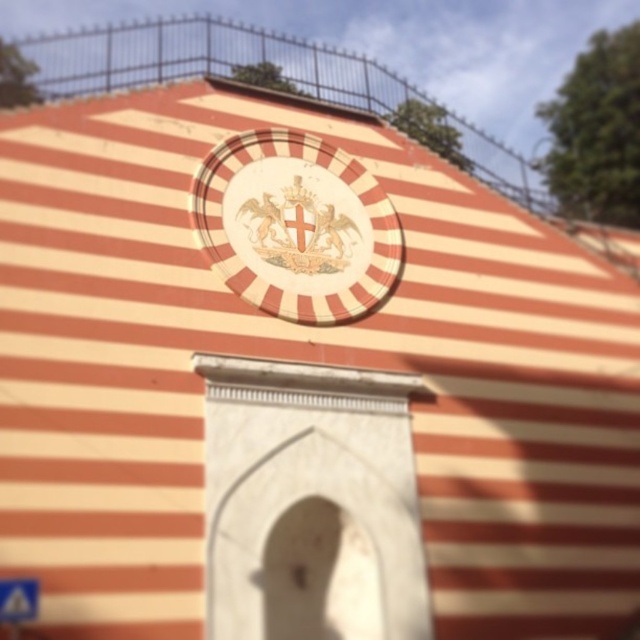
Question: Is white glossy emblem at center positioned behind blue plastic street sign at lower left?

Choices:
 (A) yes
 (B) no

Answer: (A)

Question: Which point is closer to the camera?

Choices:
 (A) (29, 608)
 (B) (332, 259)

Answer: (A)

Question: Is white glossy emblem at center to the left of blue plastic street sign at lower left from the viewer's perspective?

Choices:
 (A) no
 (B) yes

Answer: (A)

Question: Can you confirm if white glossy emblem at center is positioned above blue plastic street sign at lower left?

Choices:
 (A) yes
 (B) no

Answer: (A)